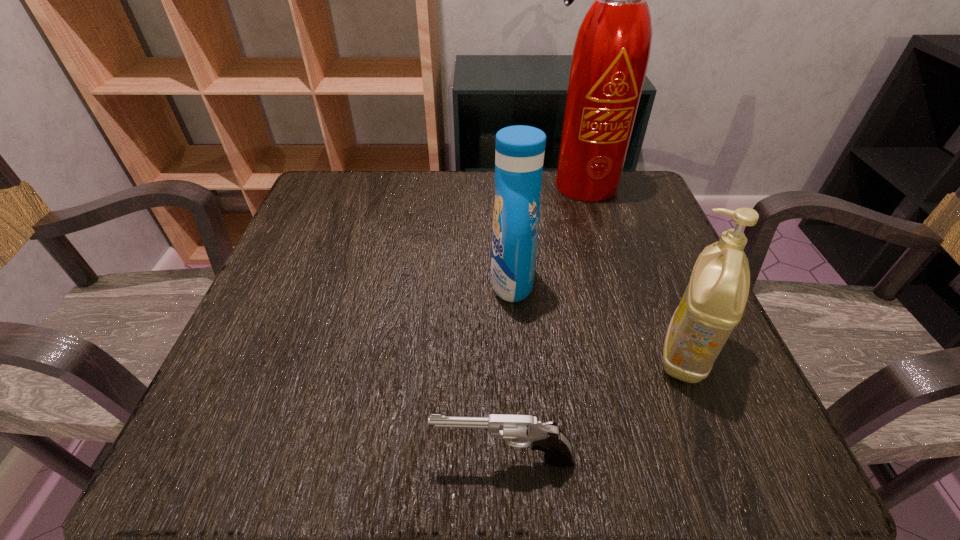
At what (x,y) coordinates should I click in order to perform the action: click on vacant area in the image that satisfies the following two spatial constraints: 1. on the front-facing side of the second tallest object; 2. on the left side of the third tallest object. Please return your answer as a coordinate pair (x, y). This screenshot has height=540, width=960. Looking at the image, I should click on (516, 353).

At what (x,y) coordinates should I click in order to perform the action: click on vacant point that satisfies the following two spatial constraints: 1. on the back side of the right detergent; 2. on the front-facing side of the second farthest object. Please return your answer as a coordinate pair (x, y). Looking at the image, I should click on (656, 281).